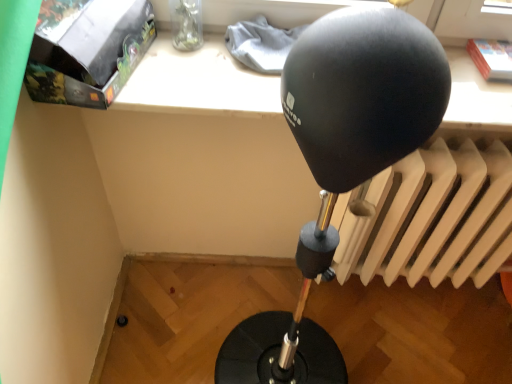
Question: Can you confirm if white matte radiator at right is positioned to the left of matte black box at upper left?

Choices:
 (A) yes
 (B) no

Answer: (B)

Question: From the image's perspective, is white matte radiator at right over matte black box at upper left?

Choices:
 (A) no
 (B) yes

Answer: (A)

Question: Can you confirm if white matte radiator at right is shorter than matte black box at upper left?

Choices:
 (A) yes
 (B) no

Answer: (B)

Question: Are white matte radiator at right and matte black box at upper left far apart?

Choices:
 (A) yes
 (B) no

Answer: (B)

Question: Is white matte radiator at right bigger than matte black box at upper left?

Choices:
 (A) yes
 (B) no

Answer: (A)

Question: Is white matte radiator at right oriented away from matte black box at upper left?

Choices:
 (A) yes
 (B) no

Answer: (B)

Question: Does matte black box at upper left have a lesser height compared to white matte radiator at right?

Choices:
 (A) no
 (B) yes

Answer: (B)

Question: Is matte black box at upper left wider than white matte radiator at right?

Choices:
 (A) no
 (B) yes

Answer: (B)

Question: Is matte black box at upper left next to white matte radiator at right?

Choices:
 (A) yes
 (B) no

Answer: (B)

Question: Does matte black box at upper left appear on the left side of white matte radiator at right?

Choices:
 (A) yes
 (B) no

Answer: (A)

Question: Is matte black box at upper left at the right side of white matte radiator at right?

Choices:
 (A) no
 (B) yes

Answer: (A)

Question: Considering the relative sizes of matte black box at upper left and white matte radiator at right in the image provided, is matte black box at upper left taller than white matte radiator at right?

Choices:
 (A) no
 (B) yes

Answer: (A)

Question: In terms of height, does matte black box at upper left look taller or shorter compared to white matte radiator at right?

Choices:
 (A) short
 (B) tall

Answer: (A)